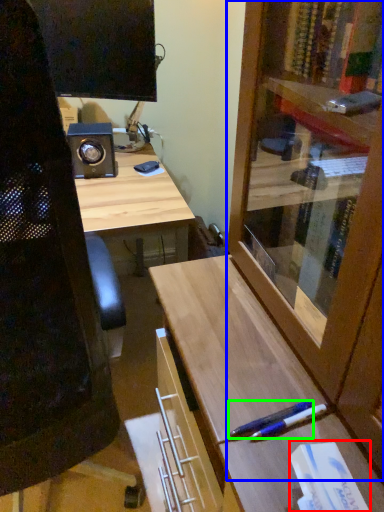
Question: Which object is the farthest from book (highlighted by a red box)? Choose among these: cabinetry (highlighted by a blue box) or pen (highlighted by a green box).

Choices:
 (A) cabinetry
 (B) pen

Answer: (A)